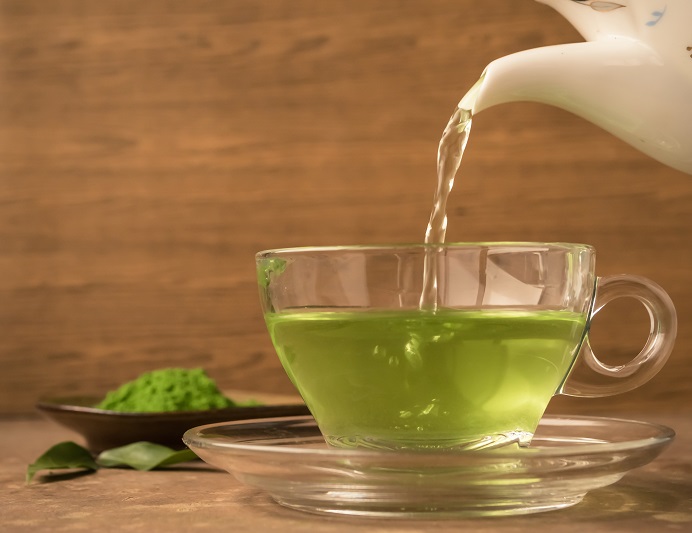
Where is `small glass plate`? small glass plate is located at coordinates (425, 482).